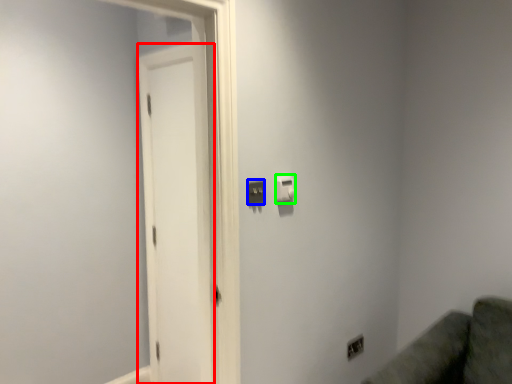
Question: Which is farther away from screen door (highlighted by a red box)? light switch (highlighted by a blue box) or light switch (highlighted by a green box)?

Choices:
 (A) light switch
 (B) light switch

Answer: (A)